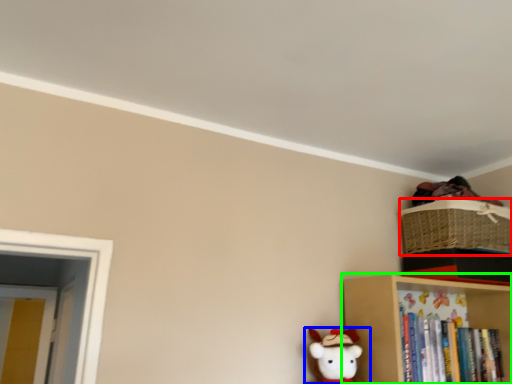
Question: Which object is the farthest from basket (highlighted by a red box)? Choose among these: toy (highlighted by a blue box) or shelf (highlighted by a green box).

Choices:
 (A) toy
 (B) shelf

Answer: (A)